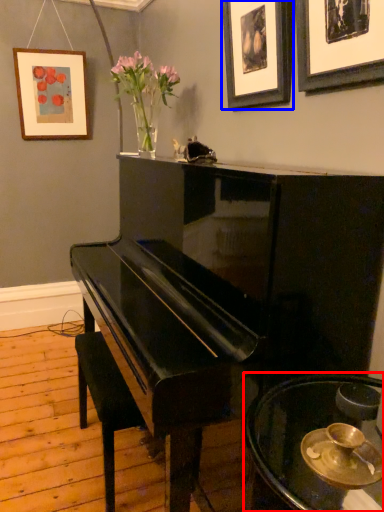
Question: Which of the following is the farthest to the observer, table (highlighted by a red box) or picture frame (highlighted by a blue box)?

Choices:
 (A) table
 (B) picture frame

Answer: (B)